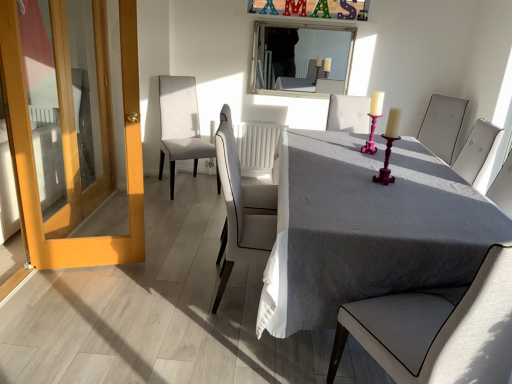
Locate an element on the screen. free spot to the left of gray fabric table at center is located at coordinates (139, 292).